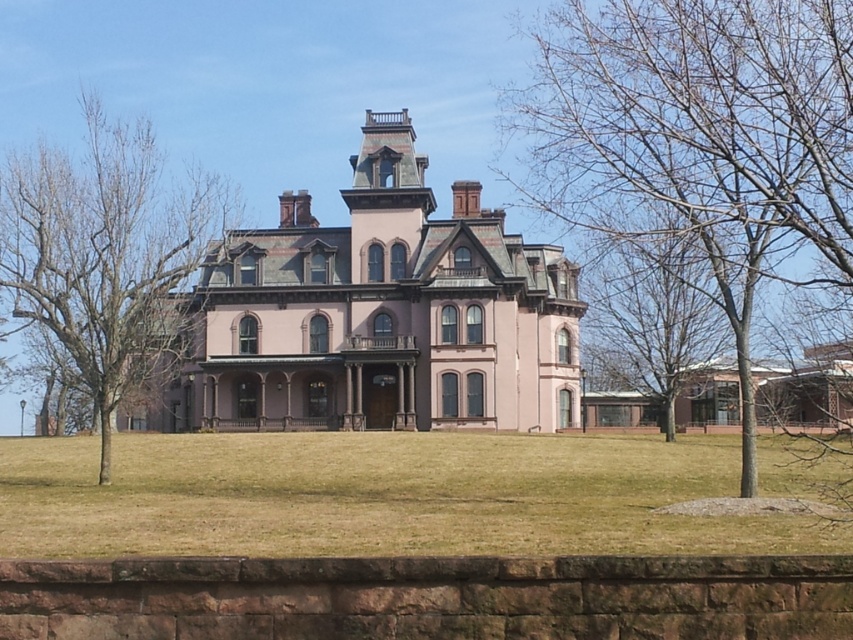
The width and height of the screenshot is (853, 640). Describe the element at coordinates (381, 314) in the screenshot. I see `pink matte mansion at center` at that location.

The width and height of the screenshot is (853, 640). I want to click on pink matte mansion at center, so pyautogui.click(x=381, y=314).

Describe the element at coordinates (381, 314) in the screenshot. This screenshot has width=853, height=640. I see `pink matte mansion at center` at that location.

You are a GUI agent. You are given a task and a screenshot of the screen. Output one action in this format:
    pyautogui.click(x=<x>, y=<y>)
    Task: Click on the pink matte mansion at center
    
    Given the screenshot: What is the action you would take?
    pyautogui.click(x=381, y=314)

Is point (740, 266) positioned behind point (146, 266)?

No, (740, 266) is in front of (146, 266).

Can you confirm if bare wood tree at center is wider than bare wood tree at left?

Indeed, bare wood tree at center has a greater width compared to bare wood tree at left.

Which is in front, point (773, 36) or point (138, 300)?

Point (773, 36)

Where is `bare wood tree at center`? Image resolution: width=853 pixels, height=640 pixels. bare wood tree at center is located at coordinates (699, 132).

Which is below, bare wood tree at center or bare branches at right?

bare branches at right

Is point (553, 164) more distant than point (666, 342)?

Yes, it is behind point (666, 342).

The width and height of the screenshot is (853, 640). I want to click on bare wood tree at center, so click(x=699, y=132).